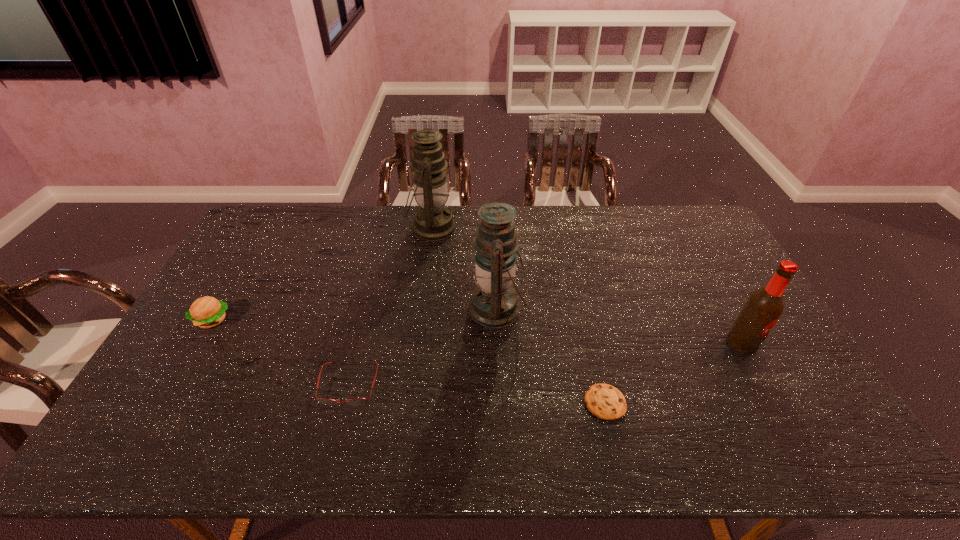
In order to click on the fifth object from left to right in this screenshot , I will do `click(606, 402)`.

Locate an element on the screen. vacant point located 0.060m on the front of the left oil lamp is located at coordinates (427, 260).

Where is `free spot located on the front of the right oil lamp`? The height and width of the screenshot is (540, 960). free spot located on the front of the right oil lamp is located at coordinates (501, 402).

Image resolution: width=960 pixels, height=540 pixels. In order to click on free location located 0.060m on the right of the beer bottle in this screenshot , I will do `click(778, 343)`.

Where is `vacant point located 0.380m on the back of the leftmost object`? This screenshot has width=960, height=540. vacant point located 0.380m on the back of the leftmost object is located at coordinates (264, 233).

You are a GUI agent. You are given a task and a screenshot of the screen. Output one action in this format:
    pyautogui.click(x=<x>, y=<y>)
    Task: Click on the vacant area located on the left of the cookie
    The width and height of the screenshot is (960, 540).
    Given the screenshot: What is the action you would take?
    pyautogui.click(x=453, y=402)

Find the location of `object that is at the far edge`. object that is at the far edge is located at coordinates (433, 221).

Locate an element on the screen. Image resolution: width=960 pixels, height=540 pixels. object present at the left edge is located at coordinates (206, 312).

Image resolution: width=960 pixels, height=540 pixels. In order to click on object that is at the right edge in this screenshot , I will do `click(765, 305)`.

Find the location of `vacant space at the far edge of the desktop`. vacant space at the far edge of the desktop is located at coordinates (477, 223).